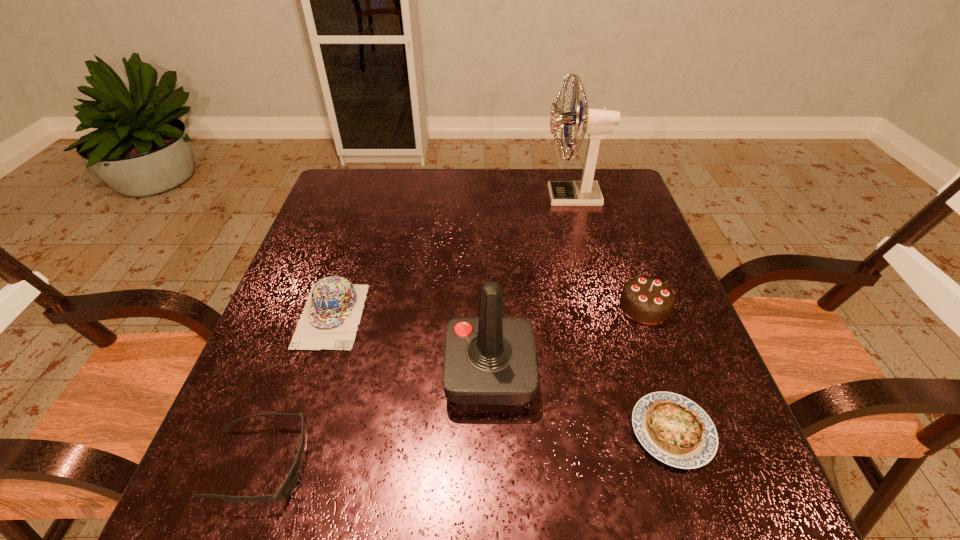
Identify the location of sunglasses that is at the left edge. (287, 487).

Where is `fan at the right edge`? The height and width of the screenshot is (540, 960). fan at the right edge is located at coordinates (597, 123).

Locate an element on the screen. The width and height of the screenshot is (960, 540). chocolate cake present at the right edge is located at coordinates (647, 300).

Where is `quiche located in the right edge section of the desktop`? This screenshot has height=540, width=960. quiche located in the right edge section of the desktop is located at coordinates (675, 430).

Identify the location of object situated at the near left corner. This screenshot has width=960, height=540. (287, 487).

I want to click on object that is at the far right corner, so click(x=597, y=123).

The image size is (960, 540). I want to click on object at the near right corner, so click(x=675, y=430).

You are a GUI agent. You are given a task and a screenshot of the screen. Output one action in this format:
    pyautogui.click(x=<x>, y=<y>)
    Task: Click on the free space at the far edge
    
    Given the screenshot: What is the action you would take?
    pyautogui.click(x=526, y=205)

You are a GUI agent. You are given a task and a screenshot of the screen. Output one action in this format:
    pyautogui.click(x=<x>, y=<y>)
    Task: Click on the vacant space at the near edge of the desktop
    This screenshot has width=960, height=540.
    Given the screenshot: What is the action you would take?
    pyautogui.click(x=395, y=507)

Locate an element on the screen. Image resolution: width=960 pixels, height=540 pixels. vacant region at the left edge of the desktop is located at coordinates (234, 417).